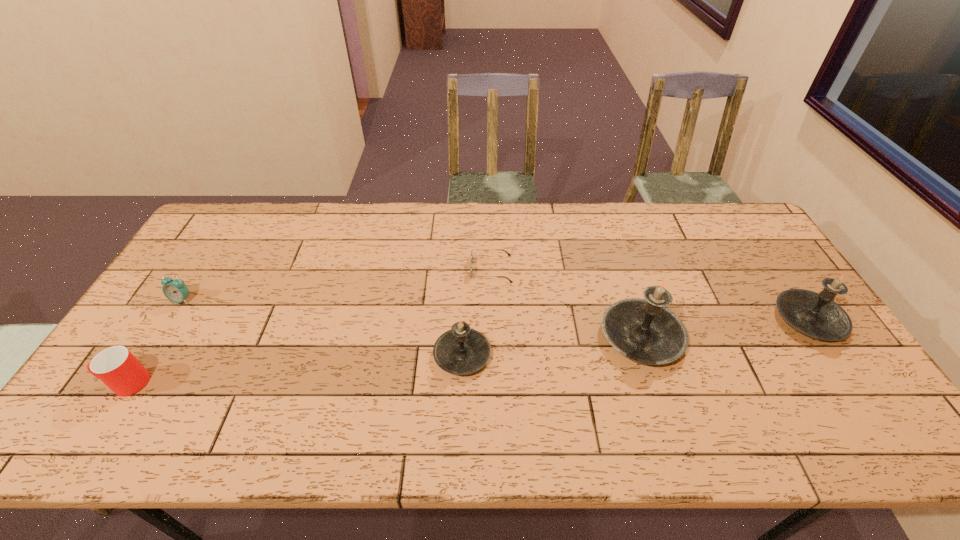
The height and width of the screenshot is (540, 960). What are the coordinates of `free space between the alarm clock and the shortest object` in the screenshot? It's located at (337, 285).

Find the location of a particular element. vacant area that lies between the tallest object and the sunglasses is located at coordinates (566, 303).

In order to click on empty location between the alarm clock and the second tallest candle in this screenshot , I will do `click(495, 309)`.

Locate an element on the screen. This screenshot has height=540, width=960. free space between the alarm clock and the cup is located at coordinates (155, 341).

What are the coordinates of `vacant space that's between the shortest object and the cup` in the screenshot? It's located at (309, 326).

This screenshot has height=540, width=960. Identify the location of vacant point located between the second candle from left to right and the alarm clock. (412, 318).

Locate an element on the screen. The width and height of the screenshot is (960, 540). free space that is in between the cup and the shortest object is located at coordinates (309, 326).

Find the location of `vacant area that lies between the sunglasses and the fourth shortest object`. vacant area that lies between the sunglasses and the fourth shortest object is located at coordinates (477, 312).

The image size is (960, 540). I want to click on blank region between the third tallest object and the tallest candle, so click(552, 346).

You are a GUI agent. You are given a task and a screenshot of the screen. Output one action in this format:
    pyautogui.click(x=<x>, y=<y>)
    Task: Click on the free spot between the rightmost candle and the second object from right to left
    
    Given the screenshot: What is the action you would take?
    pyautogui.click(x=725, y=328)